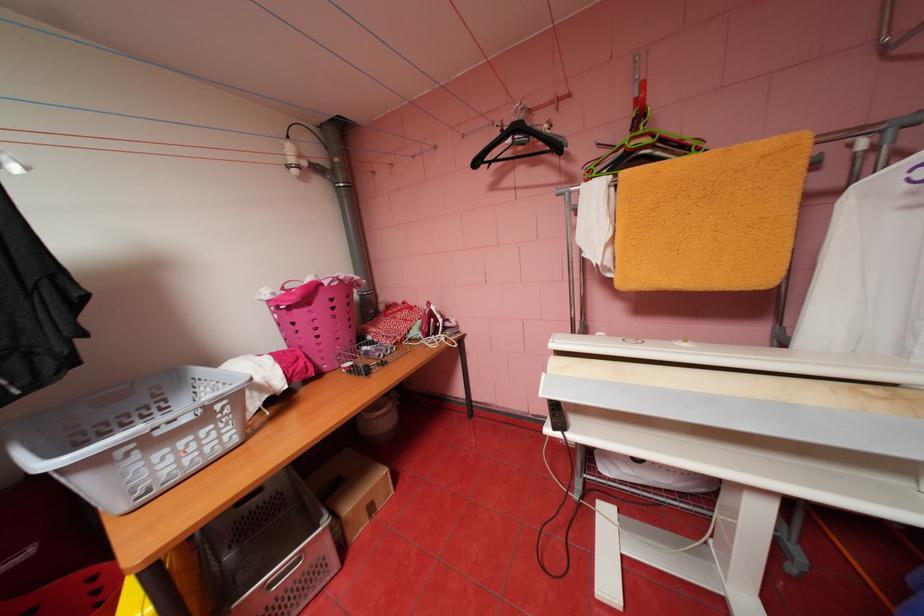
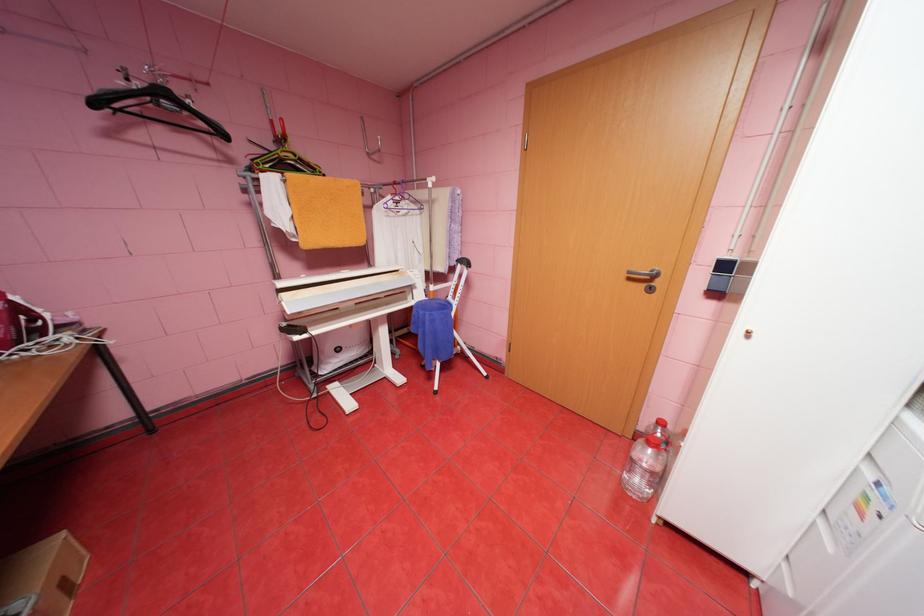
Where in the second image is the point corresponding to the point at 484,163 from the first image?

(103, 103)